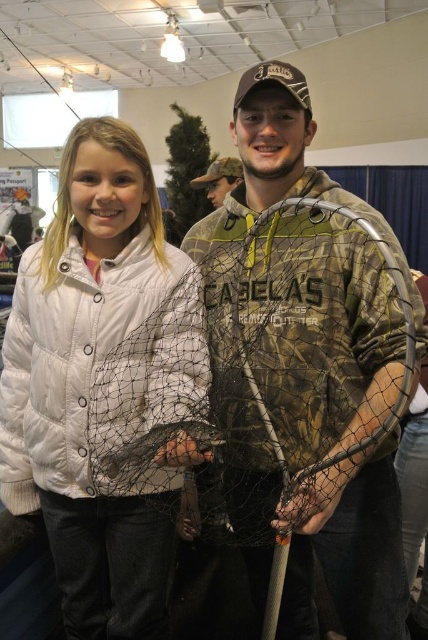
You are standing at the entrance of the exhibition hall and see the camo fabric fishing net at center. If you walk straight ahead, will you reach the net before the blue curtain?

The camo fabric fishing net at center is located at point (306, 369). Since the blue curtain is part of the background, it is further away than the net. Therefore, you will reach the camo fabric fishing net at center before the blue curtain.

You are setting up a display for a fishing gear booth at a trade show. You have two nets to hang vertically on the backdrop wall. The camo fabric fishing net at center and the translucent netting at center. The display requires the taller net to be placed on the left side. Which net should you choose for the left side?

The camo fabric fishing net at center is taller than the translucent netting at center, so you should choose the camo fabric fishing net at center for the left side of the display.